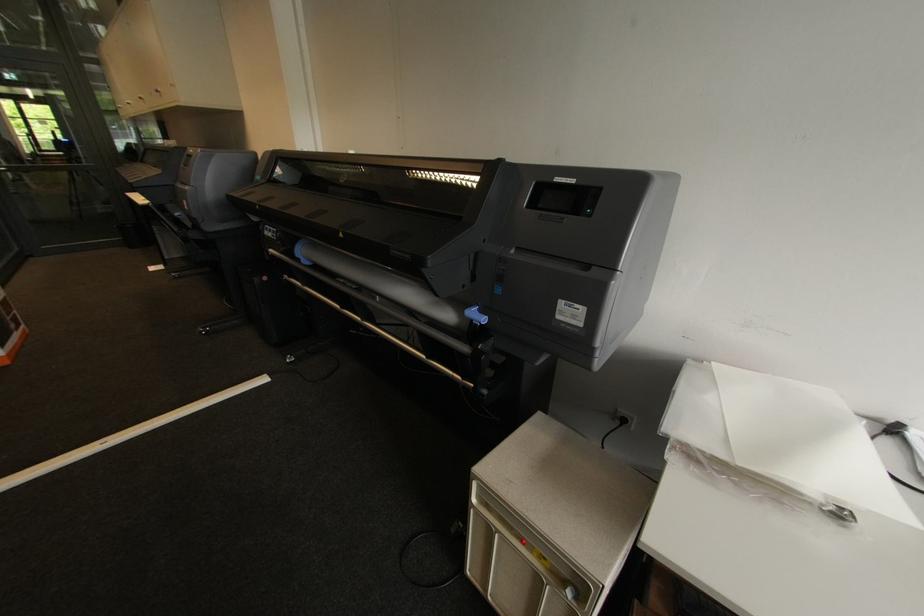
You are a GUI agent. You are given a task and a screenshot of the screen. Output one action in this format:
    pyautogui.click(x=<x>, y=<y>)
    Task: Click on the black printer cover
    
    Given the screenshot: What is the action you would take?
    pyautogui.click(x=573, y=257)